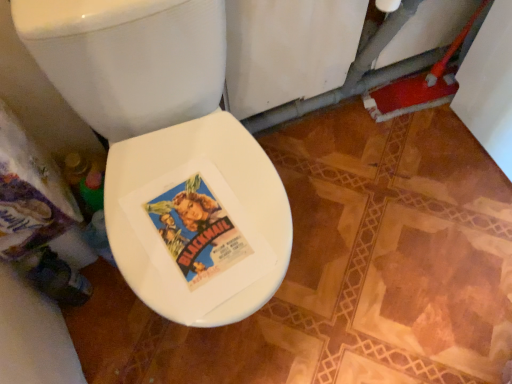
Where is `white glossy bidet at center`? The image size is (512, 384). white glossy bidet at center is located at coordinates (218, 201).

Image resolution: width=512 pixels, height=384 pixels. Describe the element at coordinates (218, 201) in the screenshot. I see `white glossy bidet at center` at that location.

What is the approximate width of white glossy toilet seat at center?

The width of white glossy toilet seat at center is 23.30 inches.

Locate an element on the screen. Image resolution: width=512 pixels, height=384 pixels. white glossy toilet seat at center is located at coordinates (169, 152).

The image size is (512, 384). Describe the element at coordinates (169, 152) in the screenshot. I see `white glossy toilet seat at center` at that location.

The width and height of the screenshot is (512, 384). I want to click on white glossy bidet at center, so click(218, 201).

Can you confirm if white glossy bidet at center is positioned to the left of white glossy toilet seat at center?

No, white glossy bidet at center is not to the left of white glossy toilet seat at center.

Is white glossy bidet at center closer to the viewer compared to white glossy toilet seat at center?

No.

Considering the positions of points (238, 268) and (213, 77), is point (238, 268) farther from camera compared to point (213, 77)?

No, it is not.

From the image's perspective, does white glossy bidet at center appear higher than white glossy toilet seat at center?

No.

From a real-world perspective, which object stands above the other?

In real-world perspective, white glossy bidet at center is above.

Is white glossy bidet at center wider than white glossy toilet seat at center?

Incorrect, the width of white glossy bidet at center does not surpass that of white glossy toilet seat at center.

Is white glossy bidet at center shorter than white glossy toilet seat at center?

Yes.

Considering the sizes of objects white glossy bidet at center and white glossy toilet seat at center in the image provided, who is bigger, white glossy bidet at center or white glossy toilet seat at center?

white glossy toilet seat at center is bigger.

Can we say white glossy bidet at center lies outside white glossy toilet seat at center?

No, most part of white glossy bidet at center lies within white glossy toilet seat at center.

Does white glossy bidet at center touch white glossy toilet seat at center?

Absolutely, white glossy bidet at center is next to and touching white glossy toilet seat at center.

Could you tell me if white glossy bidet at center is turned towards white glossy toilet seat at center?

Yes, white glossy bidet at center is aimed at white glossy toilet seat at center.

Image resolution: width=512 pixels, height=384 pixels. Identify the location of bidet above the white glossy toilet seat at center (from a real-world perspective). (218, 201).

Based on their positions, is white glossy toilet seat at center located to the left or right of white glossy bidet at center?

From the image, it's evident that white glossy toilet seat at center is to the left of white glossy bidet at center.

Is the position of white glossy toilet seat at center less distant than that of white glossy bidet at center?

Yes, it is.

Between point (196, 223) and point (144, 249), which one is positioned in front?

The point (144, 249) is closer.

From the image's perspective, is white glossy toilet seat at center above or below white glossy bidet at center?

From the image's perspective, white glossy toilet seat at center appears above white glossy bidet at center.

From a real-world perspective, which is physically below, white glossy toilet seat at center or white glossy bidet at center?

white glossy toilet seat at center, from a real-world perspective.

Considering the sizes of objects white glossy toilet seat at center and white glossy bidet at center in the image provided, who is thinner, white glossy toilet seat at center or white glossy bidet at center?

Thinner between the two is white glossy bidet at center.

Who is shorter, white glossy toilet seat at center or white glossy bidet at center?

white glossy bidet at center is shorter.

Based on their sizes in the image, would you say white glossy toilet seat at center is bigger or smaller than white glossy bidet at center?

Clearly, white glossy toilet seat at center is larger in size than white glossy bidet at center.

Does white glossy toilet seat at center contain white glossy bidet at center?

Yes, white glossy bidet at center is a part of white glossy toilet seat at center.

Is white glossy toilet seat at center not near white glossy bidet at center?

No, there isn't a large distance between white glossy toilet seat at center and white glossy bidet at center.

Is white glossy toilet seat at center turned away from white glossy bidet at center?

Yes, white glossy bidet at center is at the back of white glossy toilet seat at center.

What's the angular difference between white glossy toilet seat at center and white glossy bidet at center's facing directions?

There is a 8.76-degree angle between the facing directions of white glossy toilet seat at center and white glossy bidet at center.

Find the location of a particular element. bidet above the white glossy toilet seat at center (from a real-world perspective) is located at coordinates (218, 201).

Locate an element on the screen. The height and width of the screenshot is (384, 512). toilet above the white glossy bidet at center (from the image's perspective) is located at coordinates (169, 152).

The width and height of the screenshot is (512, 384). In the image, there is a white glossy toilet seat at center. In order to click on bidet below it (from the image's perspective) in this screenshot , I will do `click(218, 201)`.